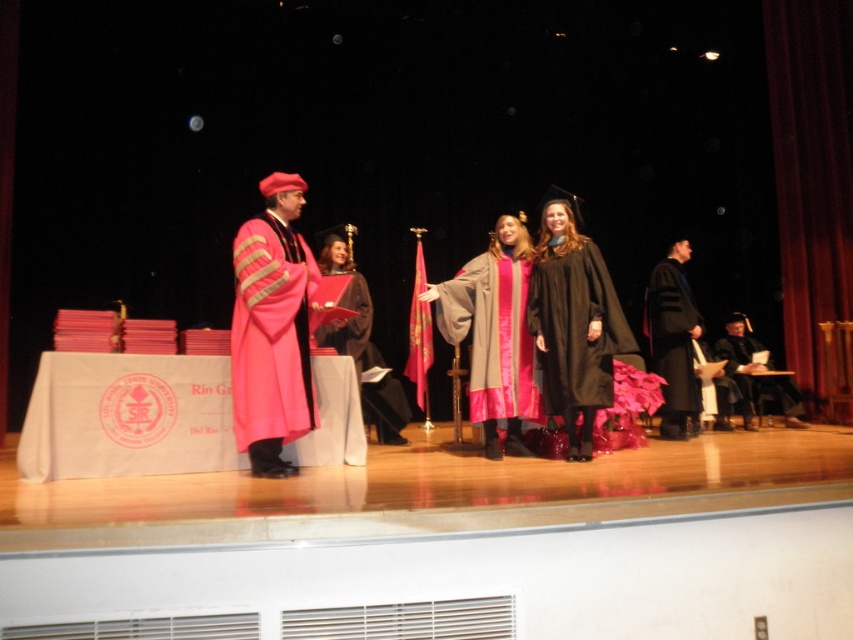
You are standing at the back of the stage during the graduation ceremony. You see two points marked on the stage floor. The first point is at coordinates point (566, 232) and the second point is at point (485, 305). Which point is closer to you?

Point (566, 232) is in front of point (485, 305), so the point closer to you is point (485, 305).

You are a photographer positioned at the back of the stage. You want to take a photo of the matte pink fabric at left and the matte black robe at lower right so that both are clearly visible. Which object should you adjust your focus to ensure it is not blocked by the other?

The matte pink fabric at left is in front of the matte black robe at lower right. To ensure both are clearly visible, you should adjust your focus to the matte pink fabric at left so it is not blocked by the matte black robe at lower right.

You are a photographer at the graduation ceremony. You want to capture a photo of both the black matte gown at center and the matte gray gown with pink accents at center clearly. However, the camera can only focus on one subject at a time. Which gown should you focus on to ensure the other is still in the background?

The black matte gown at center is positioned over matte gray gown with pink accents at center, so focusing on the black matte gown at center will keep the matte gray gown with pink accents at center in the background.